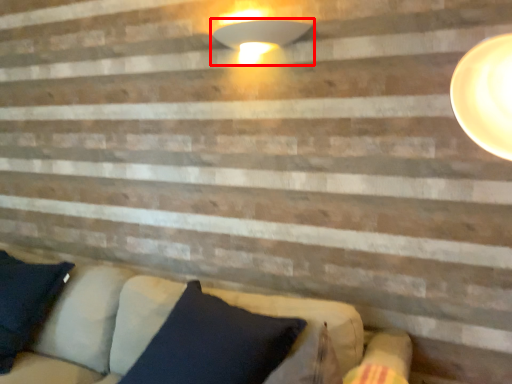
Question: From the image's perspective, considering the relative positions of lamp (annotated by the red box) and studio couch in the image provided, where is lamp (annotated by the red box) located with respect to the staircase?

Choices:
 (A) above
 (B) below

Answer: (A)